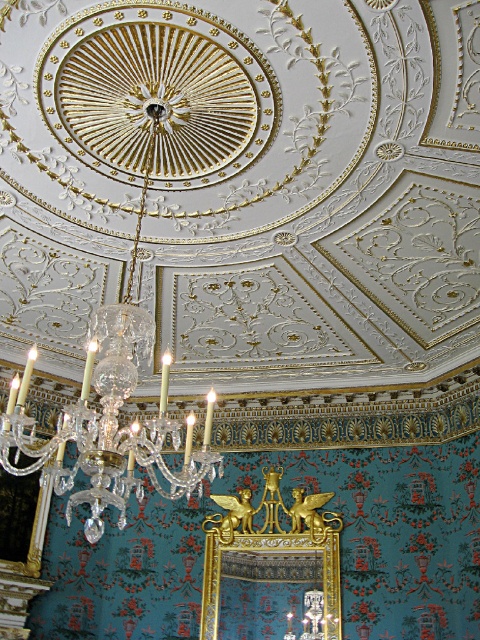
Which is in front, point (108, 465) or point (317, 531)?

Point (108, 465) is in front.

Does crystalcandlestick chandelier at center have a lesser width compared to gold metallic picture frame at center?

Correct, crystalcandlestick chandelier at center's width is less than gold metallic picture frame at center's.

Between point (147, 465) and point (251, 513), which one is positioned in front?

Point (147, 465) is in front.

What are the coordinates of `crystalcandlestick chandelier at center` in the screenshot? It's located at (108, 424).